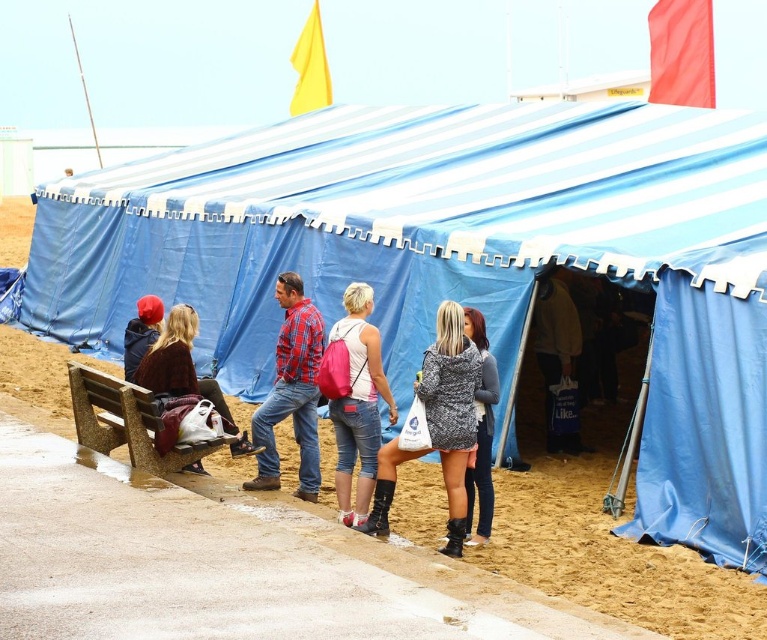
Question: Which object is the closest to the speckled gray hoodie at center?

Choices:
 (A) leather boots at lower center
 (B) pink fabric backpack at center

Answer: (A)

Question: Is plaid shirt at center to the right of leather boots at lower center from the viewer's perspective?

Choices:
 (A) no
 (B) yes

Answer: (A)

Question: Is matte brown jacket at left to the right of patterned fabric dress at center from the viewer's perspective?

Choices:
 (A) no
 (B) yes

Answer: (A)

Question: Among these objects, which one is farthest from the camera?

Choices:
 (A) leather boots at lower center
 (B) matte black jacket at left
 (C) plaid shirt at center

Answer: (B)

Question: Which object is farther from the camera taking this photo?

Choices:
 (A) plaid shirt at center
 (B) matte black jacket at left

Answer: (B)

Question: Is speckled gray hoodie at center bigger than plaid shirt at center?

Choices:
 (A) yes
 (B) no

Answer: (A)